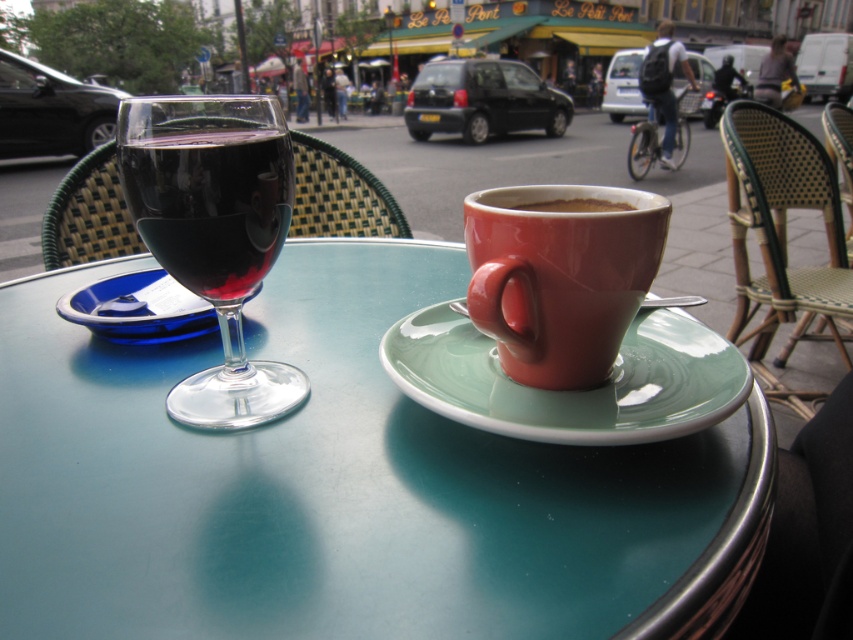
You are at a cafe and want to choose a wine glass that can hold more liquid. Which one between the transparent glass wine glass at left and the matte glass wine at left should you pick?

The transparent glass wine glass at left is much taller than the matte glass wine at left, so it can hold more liquid.

You are standing in the outdoor seating area of the cafe and want to take a photo of the point at coordinates (21, 529). The camera you are using has a minimum focus distance of 10 inches. Will the point be in focus?

The point at coordinates (21, 529) is 11.27 inches from the camera, which is beyond the minimum focus distance of 10 inches. Therefore, the point will be in focus.